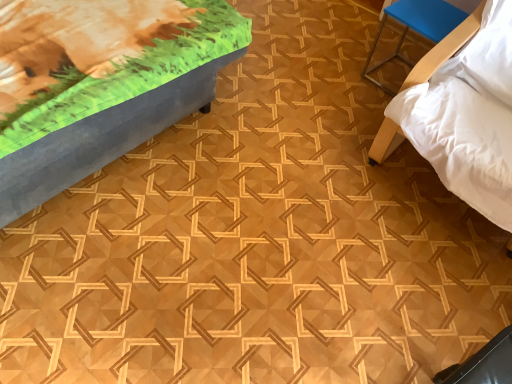
Question: Is white soft bed at right, the first furniture from the right, inside the boundaries of blue plastic stool at upper right, marked as the second furniture in a left-to-right arrangement, or outside?

Choices:
 (A) outside
 (B) inside

Answer: (A)

Question: Based on their sizes in the image, would you say white soft bed at right, the 3th furniture from the left, is bigger or smaller than blue plastic stool at upper right, marked as the second furniture in a left-to-right arrangement?

Choices:
 (A) small
 (B) big

Answer: (B)

Question: Estimate the real-world distances between objects in this image. Which object is closer to the matte gray bench at upper left, marked as the 3th furniture in a right-to-left arrangement?

Choices:
 (A) white soft bed at right, the 3th furniture from the left
 (B) blue plastic stool at upper right, positioned as the 2th furniture in right-to-left order

Answer: (A)

Question: Which of these objects is positioned farthest from the white soft bed at right, the 3th furniture from the left?

Choices:
 (A) matte gray bench at upper left, acting as the 1th furniture starting from the left
 (B) blue plastic stool at upper right, positioned as the 2th furniture in right-to-left order

Answer: (A)